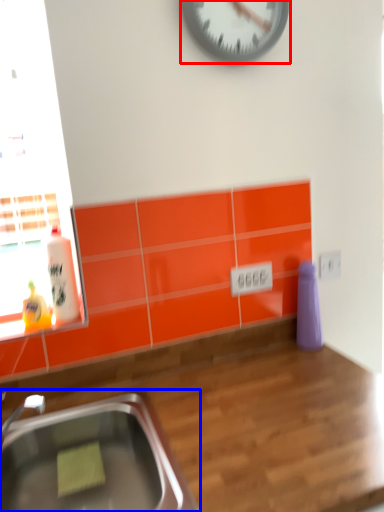
Question: Which point is further to the camera, wall clock (highlighted by a red box) or sink (highlighted by a blue box)?

Choices:
 (A) wall clock
 (B) sink

Answer: (A)